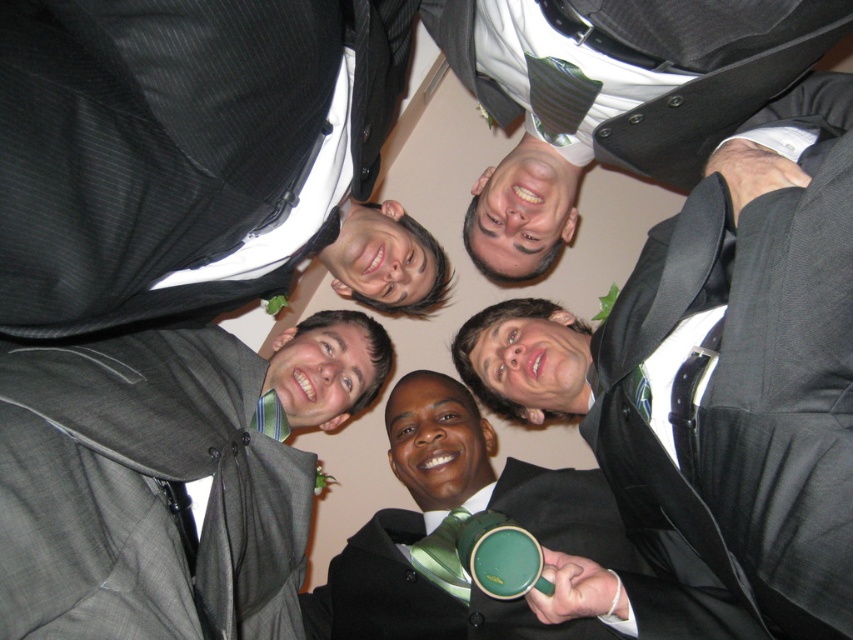
You are standing in front of the group of six people in formal attire. You notice two points marked in the image, one at coordinates point (741, 356) and the other at point (135, 256). Which point is nearer to you?

Point (741, 356) is closer to the viewer than point (135, 256).

Looking at this image, you are a photographer adjusting the camera settings to ensure both the matte black suit at upper left and the green striped tie at center are in focus. Given the depth of field, what is the minimum distance the camera should be from the subjects to achieve this?

The minimum distance should be at least half the distance between the two objects. Since they are 26.39 inches apart, the camera should be placed no closer than 13.195 inches to ensure both are in focus.